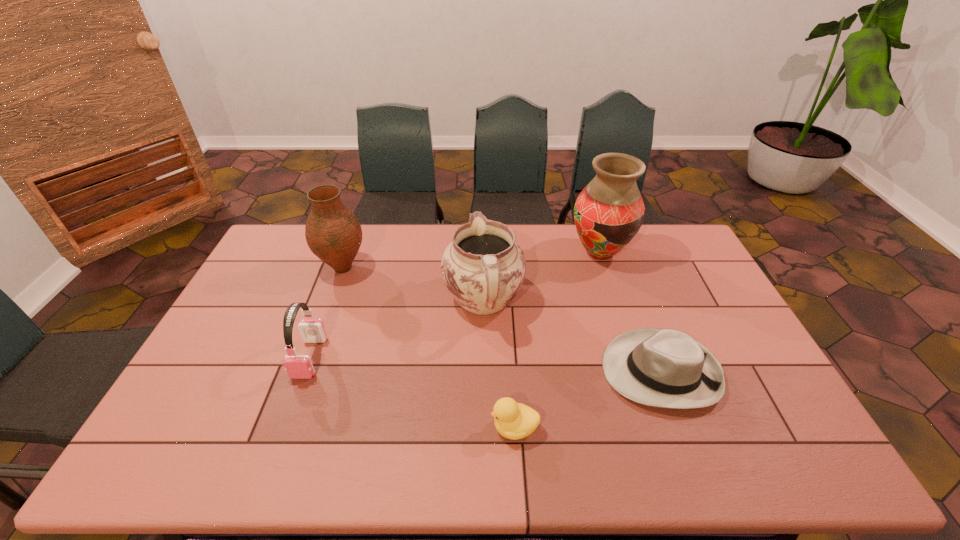
Where is `the right vase`? the right vase is located at coordinates tap(608, 213).

The width and height of the screenshot is (960, 540). Find the location of `the shorter vase`. the shorter vase is located at coordinates (333, 233).

Identify the location of the third tallest object. The width and height of the screenshot is (960, 540). (483, 267).

You are a GUI agent. You are given a task and a screenshot of the screen. Output one action in this format:
    pyautogui.click(x=<x>, y=<y>)
    Task: Click on the earphone
    The width and height of the screenshot is (960, 540).
    Given the screenshot: What is the action you would take?
    pyautogui.click(x=297, y=366)

Find the location of a particular element. The image size is (960, 540). fedora is located at coordinates (664, 368).

In order to click on duck in this screenshot , I will do `click(513, 420)`.

Identify the location of vacant area situated 0.150m on the front of the right vase. (616, 303).

Identify the location of vacant space located on the back of the shorter vase. The image size is (960, 540). (357, 230).

Locate an element on the screen. vacant space located on the spout of the third tallest object is located at coordinates (483, 240).

I want to click on vacant space situated on the spout of the third tallest object, so click(483, 231).